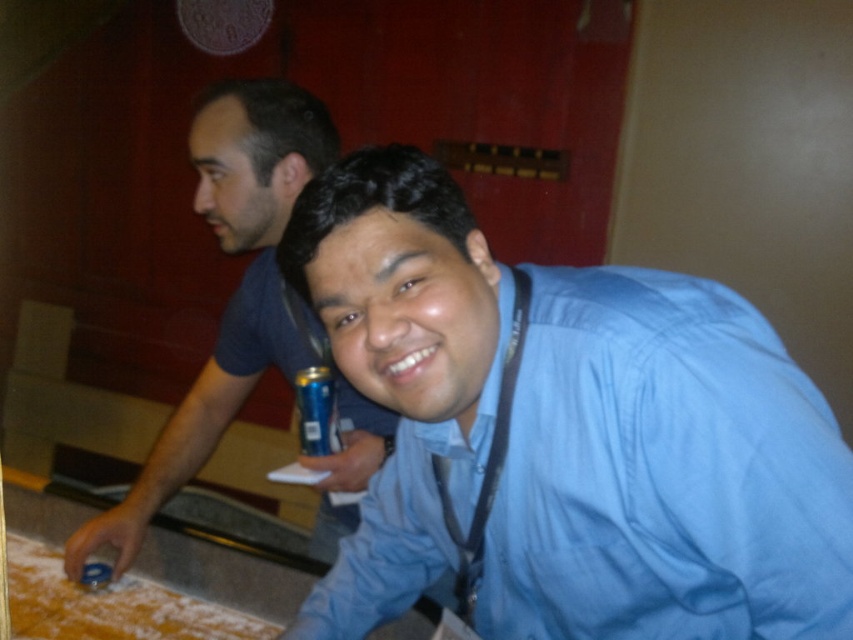
Question: Is blue denim shirt at center smaller than blue metallic can at center?

Choices:
 (A) yes
 (B) no

Answer: (B)

Question: Which object is closer to the camera taking this photo?

Choices:
 (A) blue denim shirt at center
 (B) white powdery flour at lower left
 (C) blue shirt at center

Answer: (C)

Question: Which point appears farthest from the camera in this image?

Choices:
 (A) (56, 564)
 (B) (553, 496)
 (C) (387, 435)

Answer: (A)

Question: Observing the image, what is the correct spatial positioning of white powdery flour at lower left in reference to blue metallic can at center?

Choices:
 (A) above
 (B) below

Answer: (B)

Question: Does white powdery flour at lower left have a smaller size compared to blue metallic can at center?

Choices:
 (A) yes
 (B) no

Answer: (B)

Question: Which point appears farthest from the camera in this image?

Choices:
 (A) (30, 609)
 (B) (212, 93)
 (C) (334, 442)
 (D) (570, 499)

Answer: (B)